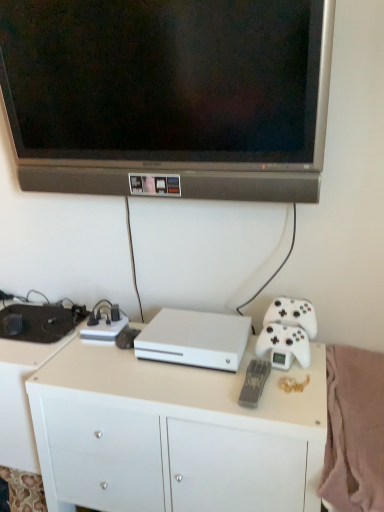
Find the location of a particular element. vacant area that is in front of white matte game controller at right is located at coordinates (296, 390).